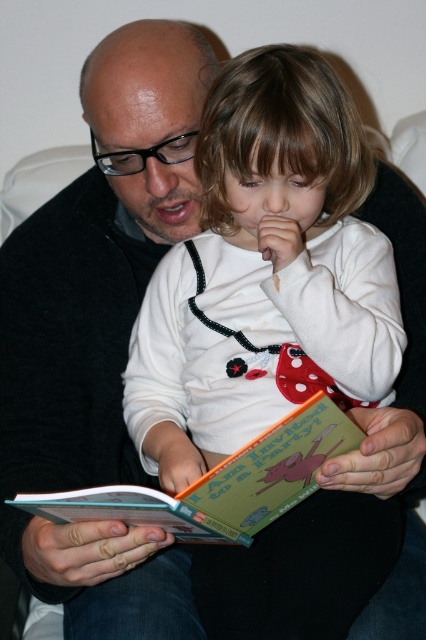
Question: Is white soft fabric shirt at center to the right of hardcover book at center from the viewer's perspective?

Choices:
 (A) yes
 (B) no

Answer: (A)

Question: Which point is farther to the camera?

Choices:
 (A) (385, 332)
 (B) (14, 502)

Answer: (A)

Question: Is white soft fabric shirt at center positioned in front of hardcover book at center?

Choices:
 (A) no
 (B) yes

Answer: (A)

Question: Is white soft fabric shirt at center below hardcover book at center?

Choices:
 (A) no
 (B) yes

Answer: (A)